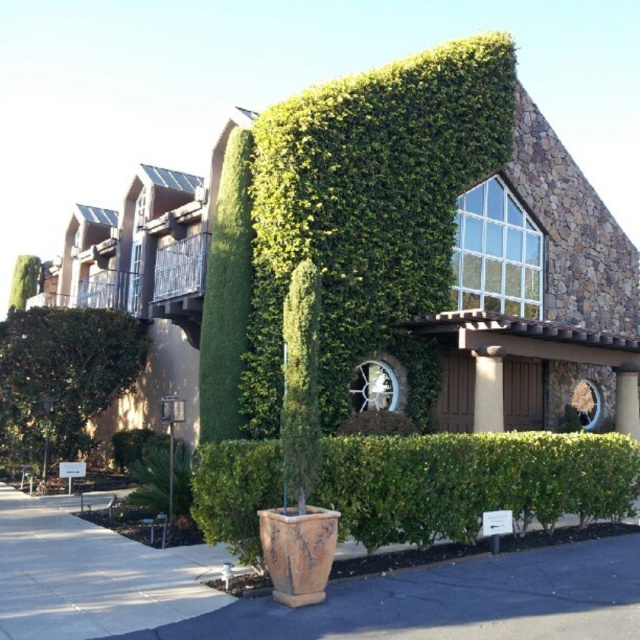
You are standing in front of the building and want to walk from the green leafy bush at lower left to the green leafy hedge at lower center. Which direction should you move?

You should move to the right to go from the green leafy bush at lower left to the green leafy hedge at lower center, as the hedge is positioned to the right of the bush.

You are standing in front of the modern architectural structure with ivy on the facade. You notice two points marked on the building. The first point is at coordinate point (515, 515) and the second is at point (86, 387). Which of these two points is closer to your current position?

Point (515, 515) is closer to the camera than point (86, 387), so the first point is closer to your current position.